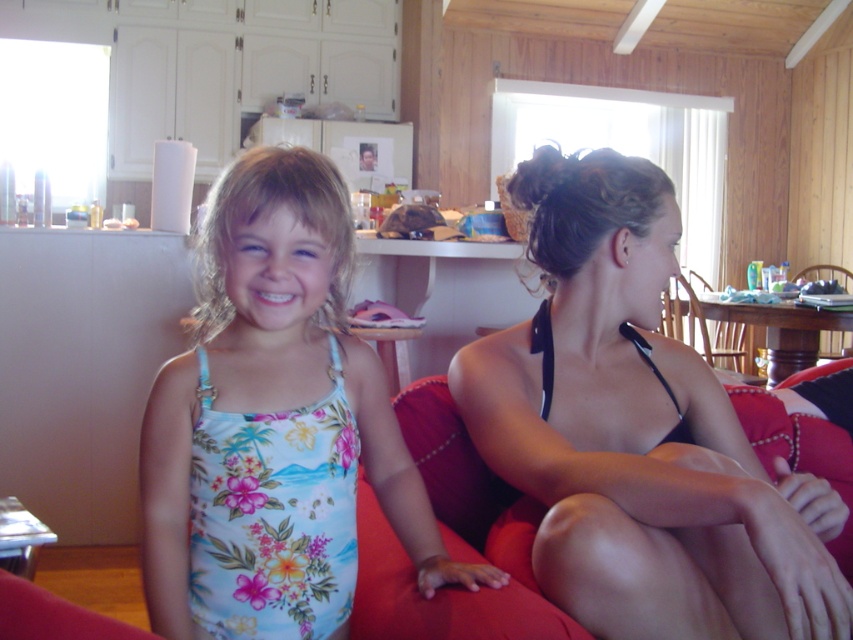
Question: Considering the real-world distances, which object is closest to the floral print swimsuit at left?

Choices:
 (A) red fabric couch at center
 (B) black satin bikini top at upper right

Answer: (A)

Question: Is floral print swimsuit at left bigger than red fabric couch at center?

Choices:
 (A) yes
 (B) no

Answer: (A)

Question: Which of the following is the farthest from the observer?

Choices:
 (A) (541, 632)
 (B) (788, 522)

Answer: (A)

Question: Does floral print swimsuit at left have a smaller size compared to red fabric couch at center?

Choices:
 (A) no
 (B) yes

Answer: (A)

Question: Does black satin bikini top at upper right have a lesser width compared to red fabric couch at center?

Choices:
 (A) yes
 (B) no

Answer: (B)

Question: Which object is the closest to the floral print swimsuit at left?

Choices:
 (A) red fabric couch at center
 (B) black satin bikini top at upper right

Answer: (A)